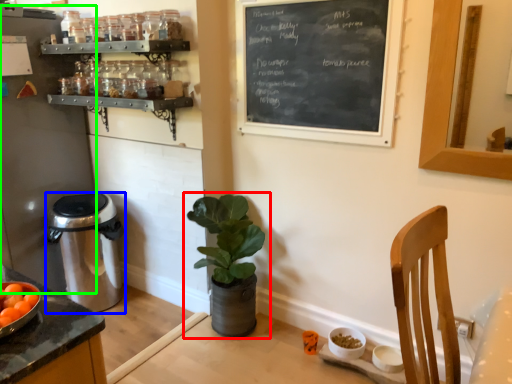
Question: Considering the real-world distances, which object is closest to houseplant (highlighted by a red box)? trash bin/can (highlighted by a blue box) or appliance (highlighted by a green box).

Choices:
 (A) trash bin/can
 (B) appliance

Answer: (A)